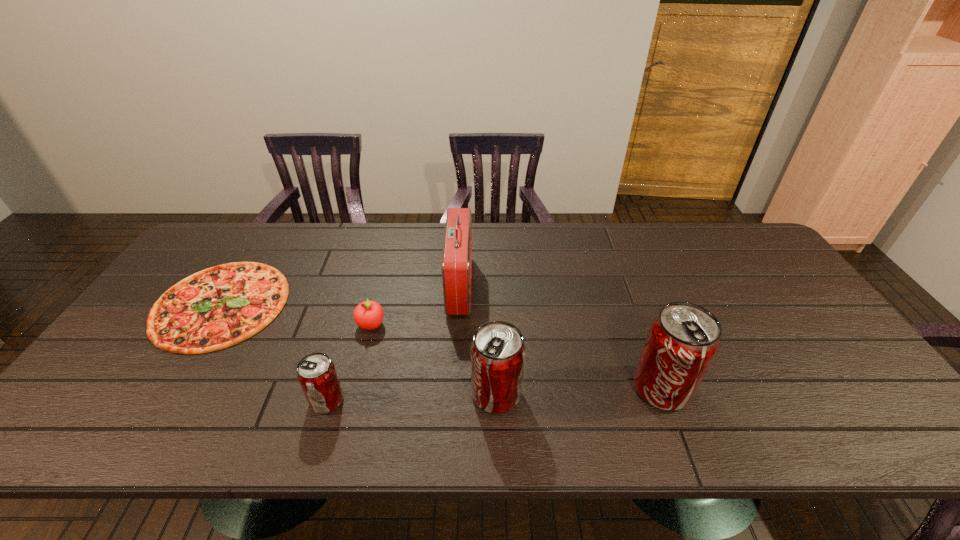
At what (x,y) coordinates should I click in order to perform the action: click on blank space that satisfies the following two spatial constraints: 1. on the side of the third object from right to left with the first aid cross symbol; 2. on the front side of the shortest pop soda. Please return your answer as a coordinate pair (x, y). This screenshot has height=540, width=960. Looking at the image, I should click on (454, 401).

Locate an element on the screen. This screenshot has width=960, height=540. vacant position in the image that satisfies the following two spatial constraints: 1. on the back side of the shortest pop soda; 2. on the right side of the fifth object from left to right is located at coordinates (329, 394).